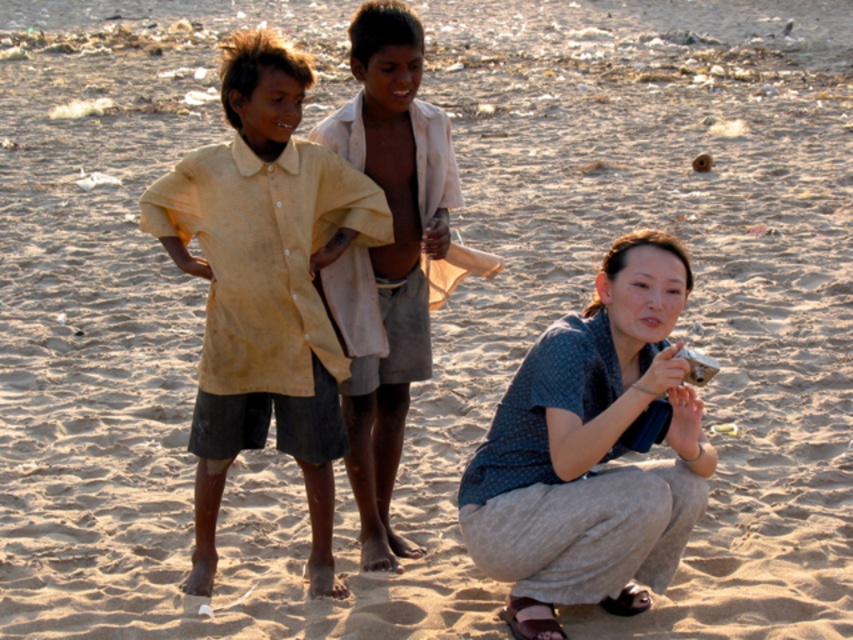
Based on the coordinates provided, which object is located at point (265, 285) in the image?

The point (265, 285) marks the yellow cotton shirt at center.

You are a photographer trying to capture a group photo of the yellow cotton shirt at center and the blue cotton shirt at lower right. What is the minimum distance you need to maintain between them to ensure both are in focus?

The minimum distance you need to maintain between the yellow cotton shirt at center and the blue cotton shirt at lower right is 3.28 feet to ensure both are in focus.

You are a photographer trying to fit both the yellow cotton shirt at center and the light brown cotton shirt at center into a frame. Which shirt should you position closer to the edges to ensure both fit within the frame?

The yellow cotton shirt at center is wider than the light brown cotton shirt at center, so positioning the wider yellow cotton shirt at center closer to the edges would allow both shirts to fit within the frame.